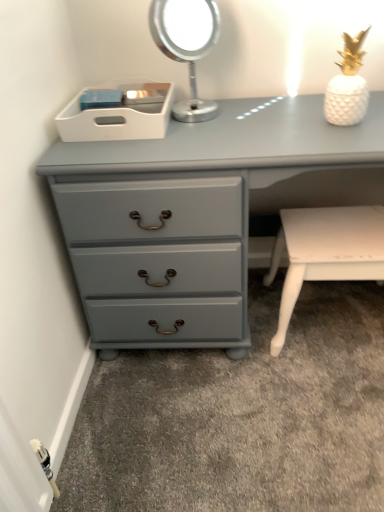
Question: Is white plastic tray at upper center to the left of metallic silver mirror at upper center from the viewer's perspective?

Choices:
 (A) no
 (B) yes

Answer: (B)

Question: Is the depth of white plastic tray at upper center greater than that of metallic silver mirror at upper center?

Choices:
 (A) no
 (B) yes

Answer: (B)

Question: From a real-world perspective, is white plastic tray at upper center physically above metallic silver mirror at upper center?

Choices:
 (A) yes
 (B) no

Answer: (B)

Question: Does white plastic tray at upper center come in front of metallic silver mirror at upper center?

Choices:
 (A) yes
 (B) no

Answer: (B)

Question: Considering the relative sizes of white plastic tray at upper center and metallic silver mirror at upper center in the image provided, is white plastic tray at upper center taller than metallic silver mirror at upper center?

Choices:
 (A) yes
 (B) no

Answer: (B)

Question: Is white plastic tray at upper center wider than metallic silver mirror at upper center?

Choices:
 (A) yes
 (B) no

Answer: (A)

Question: Is metallic silver mirror at upper center at the left side of white plastic tray at upper center?

Choices:
 (A) no
 (B) yes

Answer: (A)

Question: Is white plastic tray at upper center a part of metallic silver mirror at upper center?

Choices:
 (A) yes
 (B) no

Answer: (B)

Question: Does metallic silver mirror at upper center have a lesser width compared to white plastic tray at upper center?

Choices:
 (A) no
 (B) yes

Answer: (B)

Question: Considering the relative sizes of metallic silver mirror at upper center and white plastic tray at upper center in the image provided, is metallic silver mirror at upper center shorter than white plastic tray at upper center?

Choices:
 (A) no
 (B) yes

Answer: (A)

Question: From the image's perspective, is metallic silver mirror at upper center located above white plastic tray at upper center?

Choices:
 (A) yes
 (B) no

Answer: (A)

Question: Is the depth of metallic silver mirror at upper center less than that of white plastic tray at upper center?

Choices:
 (A) yes
 (B) no

Answer: (A)

Question: Does matte gray chest of drawers at lower left have a greater height compared to white plastic tray at upper center?

Choices:
 (A) yes
 (B) no

Answer: (A)